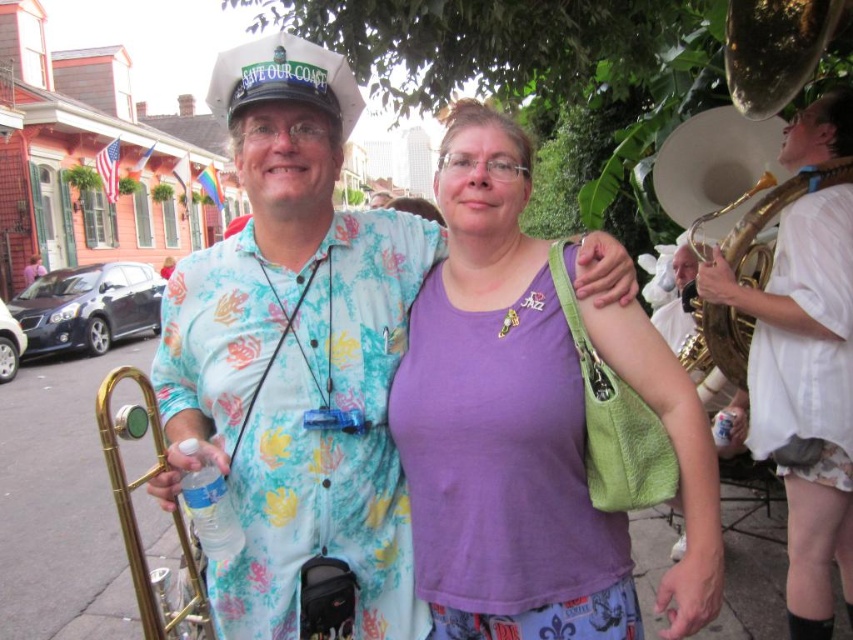
Can you confirm if floral print shirt at center is shorter than gold brass trumpet at lower left?

In fact, floral print shirt at center may be taller than gold brass trumpet at lower left.

Which is in front, point (169, 365) or point (111, 390)?

Point (111, 390) is more forward.

Find the location of a particular element. This screenshot has height=640, width=853. floral print shirt at center is located at coordinates (294, 355).

Describe the element at coordinates (502, 420) in the screenshot. This screenshot has width=853, height=640. I see `purple fabric shirt at center` at that location.

Is purple fabric shirt at center below gold brass trumpet at right?

Yes.

Measure the distance between point (469, 129) and camera.

A distance of 17.14 feet exists between point (469, 129) and camera.

Locate an element on the screen. purple fabric shirt at center is located at coordinates (502, 420).

Which is behind, point (277, 109) or point (833, 138)?

Positioned behind is point (833, 138).

Between point (392, 634) and point (819, 116), which one is positioned in front?

Point (392, 634) is more forward.

Is point (267, 474) farther from camera compared to point (686, 257)?

No, (267, 474) is in front of (686, 257).

Image resolution: width=853 pixels, height=640 pixels. Find the location of `floral print shirt at center`. floral print shirt at center is located at coordinates (294, 355).